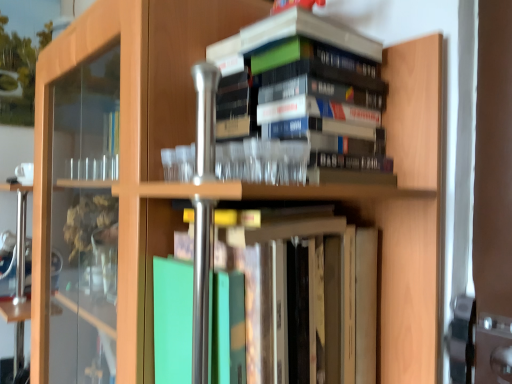
Question: Is green matte book at center, arranged as the second book when viewed from the top, far away from hardcover books at upper center, the 1th book viewed from the top?

Choices:
 (A) no
 (B) yes

Answer: (A)

Question: Is the position of green matte book at center, acting as the first book starting from the bottom, less distant than that of hardcover books at upper center, which is the 2th book in bottom-to-top order?

Choices:
 (A) yes
 (B) no

Answer: (A)

Question: Considering the relative sizes of green matte book at center, arranged as the second book when viewed from the top, and hardcover books at upper center, the 1th book viewed from the top, in the image provided, is green matte book at center, arranged as the second book when viewed from the top, shorter than hardcover books at upper center, the 1th book viewed from the top,?

Choices:
 (A) yes
 (B) no

Answer: (B)

Question: From the image's perspective, is green matte book at center, acting as the first book starting from the bottom, above hardcover books at upper center, the 1th book viewed from the top?

Choices:
 (A) no
 (B) yes

Answer: (A)

Question: Can you confirm if green matte book at center, arranged as the second book when viewed from the top, is smaller than hardcover books at upper center, the 1th book viewed from the top?

Choices:
 (A) no
 (B) yes

Answer: (A)

Question: Can you confirm if green matte book at center, arranged as the second book when viewed from the top, is positioned to the right of hardcover books at upper center, the 1th book viewed from the top?

Choices:
 (A) yes
 (B) no

Answer: (B)

Question: From the image's perspective, would you say hardcover books at upper center, the 1th book viewed from the top, is positioned over green matte book at center, acting as the first book starting from the bottom?

Choices:
 (A) yes
 (B) no

Answer: (A)

Question: Does hardcover books at upper center, the 1th book viewed from the top, appear on the right side of green matte book at center, acting as the first book starting from the bottom?

Choices:
 (A) no
 (B) yes

Answer: (B)

Question: Does hardcover books at upper center, which is the 2th book in bottom-to-top order, appear on the left side of green matte book at center, acting as the first book starting from the bottom?

Choices:
 (A) yes
 (B) no

Answer: (B)

Question: From the image's perspective, is hardcover books at upper center, which is the 2th book in bottom-to-top order, under green matte book at center, arranged as the second book when viewed from the top?

Choices:
 (A) yes
 (B) no

Answer: (B)

Question: From a real-world perspective, is hardcover books at upper center, the 1th book viewed from the top, physically above green matte book at center, acting as the first book starting from the bottom?

Choices:
 (A) yes
 (B) no

Answer: (A)

Question: Considering the relative sizes of hardcover books at upper center, which is the 2th book in bottom-to-top order, and green matte book at center, acting as the first book starting from the bottom, in the image provided, is hardcover books at upper center, which is the 2th book in bottom-to-top order, taller than green matte book at center, acting as the first book starting from the bottom,?

Choices:
 (A) yes
 (B) no

Answer: (B)

Question: Looking at their shapes, would you say hardcover books at upper center, the 1th book viewed from the top, is wider or thinner than green matte book at center, arranged as the second book when viewed from the top?

Choices:
 (A) thin
 (B) wide

Answer: (A)